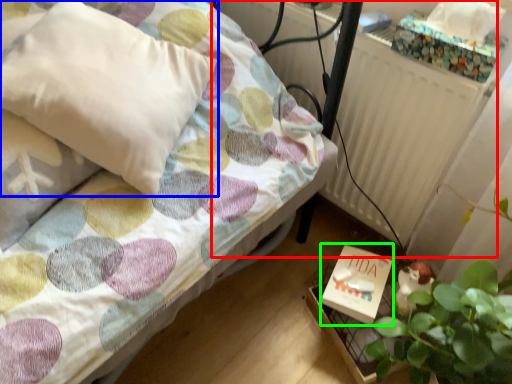
Question: Which is farther away from radiator (highlighted by a red box)? pillow (highlighted by a blue box) or box (highlighted by a green box)?

Choices:
 (A) pillow
 (B) box

Answer: (A)